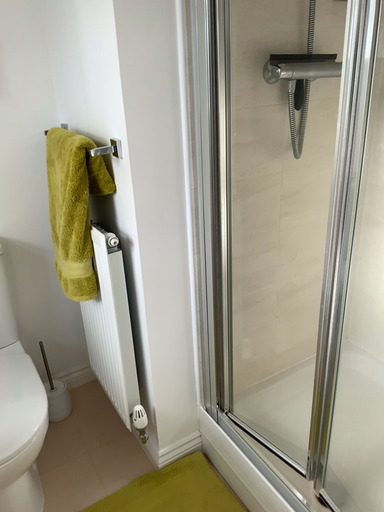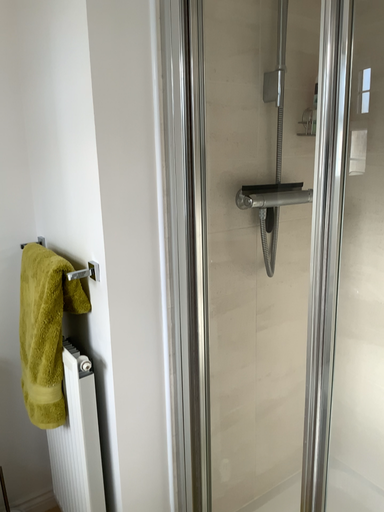
Question: How did the camera likely rotate when shooting the video?

Choices:
 (A) rotated downward
 (B) rotated upward

Answer: (B)